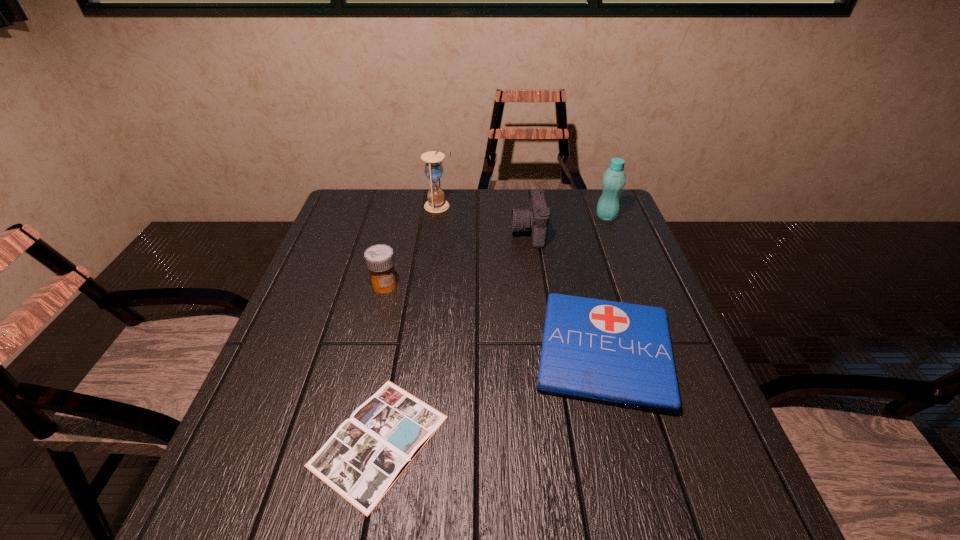
This screenshot has height=540, width=960. What are the coordinates of `vacant space that satisfies the following two spatial constraints: 1. on the front side of the hourglass; 2. on the left side of the first-aid kit` in the screenshot? It's located at (420, 352).

At what (x,y) coordinates should I click in order to perform the action: click on vacant region that satisfies the following two spatial constraints: 1. on the label side of the third nearest object; 2. on the left side of the shortest object. Please return your answer as a coordinate pair (x, y). The width and height of the screenshot is (960, 540). Looking at the image, I should click on (347, 440).

You are a GUI agent. You are given a task and a screenshot of the screen. Output one action in this format:
    pyautogui.click(x=<x>, y=<y>)
    Task: Click on the vacant space that satisfies the following two spatial constraints: 1. at the lens of the camera; 2. on the back side of the first-aid kit
    The image size is (960, 540).
    Given the screenshot: What is the action you would take?
    pyautogui.click(x=545, y=352)

Locate an element on the screen. The width and height of the screenshot is (960, 540). free space that satisfies the following two spatial constraints: 1. on the front side of the hourglass; 2. on the left side of the first-aid kit is located at coordinates (420, 352).